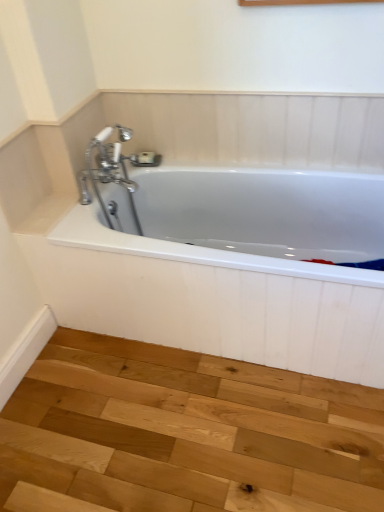
Question: Could natural wood stair at lower left be considered to be inside white glossy bathtub at center?

Choices:
 (A) yes
 (B) no

Answer: (B)

Question: Is white glossy bathtub at center at the left side of natural wood stair at lower left?

Choices:
 (A) no
 (B) yes

Answer: (A)

Question: Are white glossy bathtub at center and natural wood stair at lower left located far from each other?

Choices:
 (A) yes
 (B) no

Answer: (B)

Question: Is white glossy bathtub at center at the right side of natural wood stair at lower left?

Choices:
 (A) yes
 (B) no

Answer: (A)

Question: Would you say white glossy bathtub at center is outside natural wood stair at lower left?

Choices:
 (A) no
 (B) yes

Answer: (B)

Question: From the image's perspective, is white glossy bathtub at center below natural wood stair at lower left?

Choices:
 (A) yes
 (B) no

Answer: (B)

Question: From a real-world perspective, is natural wood stair at lower left over white glossy bathtub at center?

Choices:
 (A) no
 (B) yes

Answer: (A)

Question: Considering the relative sizes of natural wood stair at lower left and white glossy bathtub at center in the image provided, is natural wood stair at lower left taller than white glossy bathtub at center?

Choices:
 (A) no
 (B) yes

Answer: (A)

Question: From the image's perspective, does natural wood stair at lower left appear higher than white glossy bathtub at center?

Choices:
 (A) yes
 (B) no

Answer: (B)

Question: Is natural wood stair at lower left to the right of white glossy bathtub at center from the viewer's perspective?

Choices:
 (A) no
 (B) yes

Answer: (A)

Question: Is natural wood stair at lower left with white glossy bathtub at center?

Choices:
 (A) no
 (B) yes

Answer: (A)

Question: Considering the relative positions of natural wood stair at lower left and white glossy bathtub at center in the image provided, is natural wood stair at lower left behind white glossy bathtub at center?

Choices:
 (A) yes
 (B) no

Answer: (B)

Question: Considering the positions of point (205, 208) and point (200, 506), is point (205, 208) closer or farther from the camera than point (200, 506)?

Choices:
 (A) closer
 (B) farther

Answer: (B)